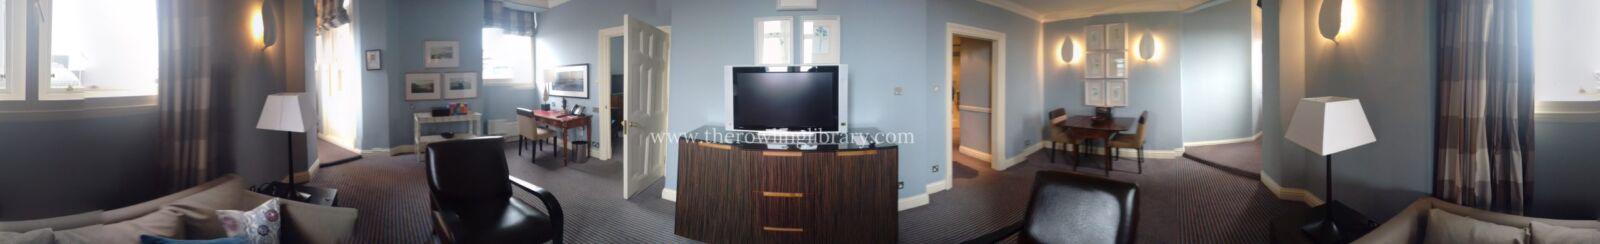
Where is `desk`? This screenshot has height=244, width=1600. desk is located at coordinates (549, 118).